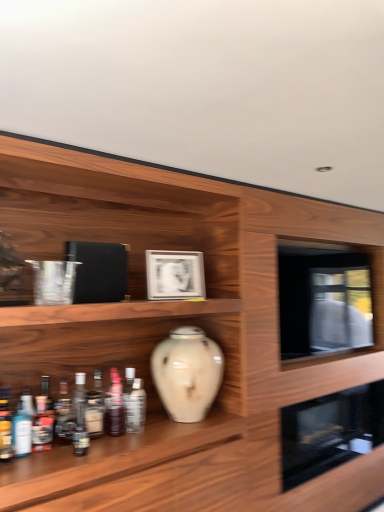
Where is `translucent plastic bottle at lower left, the 6th bottle viewed from the left`? Image resolution: width=384 pixels, height=512 pixels. translucent plastic bottle at lower left, the 6th bottle viewed from the left is located at coordinates (115, 405).

Where is `translucent glass bottles at center, the 5th bottle from the right`? This screenshot has width=384, height=512. translucent glass bottles at center, the 5th bottle from the right is located at coordinates (95, 407).

This screenshot has width=384, height=512. Identify the location of translucent glass bottle at lower left, which is counted as the second bottle, starting from the right. click(128, 398).

Identify the location of picture frame on the left side of black glass oven at center, the first oven viewed from the top. The image size is (384, 512). (175, 275).

Is matte silver picture frame at center taller than black glass oven at center, the first oven viewed from the top?

Incorrect, the height of matte silver picture frame at center is not larger of that of black glass oven at center, the first oven viewed from the top.

Could you tell me if matte silver picture frame at center is turned towards black glass oven at center, the second oven when ordered from bottom to top?

No.

Between matte silver picture frame at center and black glass oven at center, the second oven when ordered from bottom to top, which one has larger width?

With larger width is matte silver picture frame at center.

Consider the image. How many degrees apart are the facing directions of matte silver picture frame at center and translucent plastic bottle at center, acting as the 8th bottle starting from the left?

The angular difference between matte silver picture frame at center and translucent plastic bottle at center, acting as the 8th bottle starting from the left, is 14.3 degrees.

Considering the relative sizes of matte silver picture frame at center and translucent plastic bottle at center, acting as the 8th bottle starting from the left, in the image provided, is matte silver picture frame at center wider than translucent plastic bottle at center, acting as the 8th bottle starting from the left,?

Yes, matte silver picture frame at center is wider than translucent plastic bottle at center, acting as the 8th bottle starting from the left.

Could you tell me if matte silver picture frame at center is turned towards translucent plastic bottle at center, the 1th bottle from the right?

No.

Is matte silver picture frame at center in front of translucent plastic bottle at center, the 1th bottle from the right?

No, the depth of matte silver picture frame at center is greater than that of translucent plastic bottle at center, the 1th bottle from the right.

Between black glass oven at lower right, arranged as the 1th oven when ordered from the bottom, and translucent glass bottle at lower left, placed as the 1th bottle when sorted from left to right, which one has smaller width?

translucent glass bottle at lower left, placed as the 1th bottle when sorted from left to right.

How many degrees apart are the facing directions of black glass oven at lower right, arranged as the 1th oven when ordered from the bottom, and translucent glass bottle at lower left, placed as the 1th bottle when sorted from left to right?

The angular difference between black glass oven at lower right, arranged as the 1th oven when ordered from the bottom, and translucent glass bottle at lower left, placed as the 1th bottle when sorted from left to right, is 0.522 degrees.

Could translucent glass bottle at lower left, placed as the 1th bottle when sorted from left to right, be considered to be inside black glass oven at lower right, arranged as the 1th oven when ordered from the bottom?

No, black glass oven at lower right, arranged as the 1th oven when ordered from the bottom, does not contain translucent glass bottle at lower left, placed as the 1th bottle when sorted from left to right.

Is black glass oven at lower right, marked as the 2th oven in a top-to-bottom arrangement, not close to translucent glass bottle at lower left, which appears as the 8th bottle when viewed from the right?

Yes, black glass oven at lower right, marked as the 2th oven in a top-to-bottom arrangement, is far from translucent glass bottle at lower left, which appears as the 8th bottle when viewed from the right.

Is translucent glass bottle at lower left, placed as the 4th bottle when sorted from right to left, positioned behind white glossy vase at center?

No, translucent glass bottle at lower left, placed as the 4th bottle when sorted from right to left, is closer to the camera.

Looking at their sizes, would you say translucent glass bottle at lower left, placed as the 4th bottle when sorted from right to left, is wider or thinner than white glossy vase at center?

Clearly, translucent glass bottle at lower left, placed as the 4th bottle when sorted from right to left, has less width compared to white glossy vase at center.

Is translucent glass bottle at lower left, the 5th bottle when ordered from left to right, next to white glossy vase at center?

No.

Is translucent glass bottle at lower left, the 5th bottle when ordered from left to right, taller or shorter than white glossy vase at center?

translucent glass bottle at lower left, the 5th bottle when ordered from left to right, is shorter than white glossy vase at center.

From a real-world perspective, is white glossy vase at center positioned under translucent glass bottle at lower left, which appears as the 8th bottle when viewed from the right, based on gravity?

No, from a real-world perspective, white glossy vase at center is not under translucent glass bottle at lower left, which appears as the 8th bottle when viewed from the right.

Can you tell me how much white glossy vase at center and translucent glass bottle at lower left, which appears as the 8th bottle when viewed from the right, differ in facing direction?

1.27 degrees separate the facing orientations of white glossy vase at center and translucent glass bottle at lower left, which appears as the 8th bottle when viewed from the right.

Consider the image. Which of these two, white glossy vase at center or translucent glass bottle at lower left, placed as the 1th bottle when sorted from left to right, is wider?

Wider between the two is white glossy vase at center.

Considering the positions of objects matte silver picture frame at center and translucent glass bottle at lower left, which is counted as the second bottle, starting from the right, in the image provided, who is more to the left, matte silver picture frame at center or translucent glass bottle at lower left, which is counted as the second bottle, starting from the right,?

translucent glass bottle at lower left, which is counted as the second bottle, starting from the right, is more to the left.

Looking at the image, does matte silver picture frame at center seem bigger or smaller compared to translucent glass bottle at lower left, positioned as the 7th bottle in left-to-right order?

In the image, matte silver picture frame at center appears to be larger than translucent glass bottle at lower left, positioned as the 7th bottle in left-to-right order.

From the picture: From the image's perspective, is matte silver picture frame at center under translucent glass bottle at lower left, positioned as the 7th bottle in left-to-right order?

Incorrect, from the image's perspective, matte silver picture frame at center is higher than translucent glass bottle at lower left, positioned as the 7th bottle in left-to-right order.

Looking at this image, from a real-world perspective, is matte silver picture frame at center under translucent glass bottle at lower left, positioned as the 7th bottle in left-to-right order?

No.

Considering the positions of points (201, 287) and (205, 408), is point (201, 287) farther from camera compared to point (205, 408)?

Yes, it is.

Does matte silver picture frame at center have a larger size compared to white glossy vase at center?

No, matte silver picture frame at center is not bigger than white glossy vase at center.

Which object is positioned more to the left, matte silver picture frame at center or white glossy vase at center?

matte silver picture frame at center.

Find the location of `the 1st oven positioned below the matte silver picture frame at center (from a real-world perspective)`. the 1st oven positioned below the matte silver picture frame at center (from a real-world perspective) is located at coordinates (324, 301).

I want to click on picture frame lying above the translucent plastic bottle at center, acting as the 8th bottle starting from the left (from the image's perspective), so click(x=175, y=275).

Which object lies further to the anchor point white glossy vase at center, black glass oven at lower right, arranged as the 1th oven when ordered from the bottom, or translucent plastic bottle at center, the 1th bottle from the right?

The object further to white glossy vase at center is translucent plastic bottle at center, the 1th bottle from the right.

From the image, which object appears to be nearer to white glossy vase at center, translucent glass bottles at center, the 5th bottle from the right, or black glass oven at center, the first oven viewed from the top?

The object closer to white glossy vase at center is black glass oven at center, the first oven viewed from the top.

Estimate the real-world distances between objects in this image. Which object is further from translucent glass bottle at lower left, placed as the 1th bottle when sorted from left to right, black glass oven at center, the first oven viewed from the top, or translucent glass bottles at center, the 5th bottle from the right?

black glass oven at center, the first oven viewed from the top.

Based on their spatial positions, is white glossy vase at center or translucent glass bottles at center, the 5th bottle from the right, closer to translucent glass bottle at lower left, the 5th bottle when ordered from left to right?

The object closer to translucent glass bottle at lower left, the 5th bottle when ordered from left to right, is translucent glass bottles at center, the 5th bottle from the right.

Which object lies further to the anchor point white glossy vase at center, matte silver picture frame at center or white glossy vase at center?

matte silver picture frame at center lies further to white glossy vase at center than the other object.

Considering their positions, is translucent glass bottle at lower left, placed as the 4th bottle when sorted from right to left, positioned further to translucent glass bottle at lower left, which is counted as the second bottle, starting from the left, than matte silver picture frame at center?

Based on the image, matte silver picture frame at center appears to be further to translucent glass bottle at lower left, which is counted as the second bottle, starting from the left.

Which object lies nearer to the anchor point black glass oven at center, the second oven when ordered from bottom to top, translucent glass bottle at lower left, positioned as the 7th bottle in left-to-right order, or translucent glass bottle at lower left, the seventh bottle from the right?

translucent glass bottle at lower left, positioned as the 7th bottle in left-to-right order, is closer to black glass oven at center, the second oven when ordered from bottom to top.

When comparing their distances from white glossy vase at center, does translucent glass bottle at lower left, the seventh bottle from the right, or black glass oven at lower right, marked as the 2th oven in a top-to-bottom arrangement, seem further?

The object further to white glossy vase at center is translucent glass bottle at lower left, the seventh bottle from the right.

What are the coordinates of `vase situated between translucent plastic bottle at center, acting as the 8th bottle starting from the left, and black glass oven at center, the second oven when ordered from bottom to top, from left to right` in the screenshot? It's located at (187, 373).

The width and height of the screenshot is (384, 512). I want to click on vase between translucent plastic bottle at lower left, positioned as the third bottle in right-to-left order, and black glass oven at center, the first oven viewed from the top, so click(x=187, y=373).

Locate an element on the screen. This screenshot has width=384, height=512. shelf between translucent plastic bottle at lower left, the 6th bottle viewed from the left, and black glass oven at lower right, arranged as the 1th oven when ordered from the bottom, in the horizontal direction is located at coordinates (173, 327).

Where is `picture frame between translucent glass bottle at lower left, the seventh bottle from the right, and white glossy vase at center from left to right`? picture frame between translucent glass bottle at lower left, the seventh bottle from the right, and white glossy vase at center from left to right is located at coordinates (175, 275).